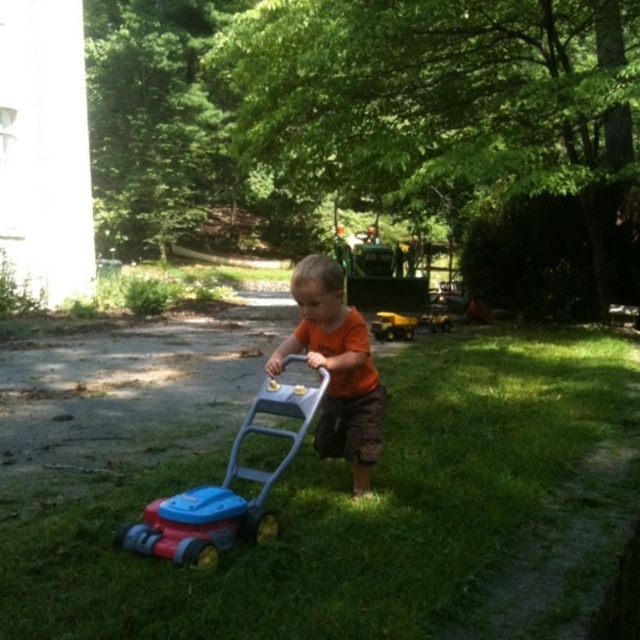
You are a photographer trying to capture a clear shot of the orange matte shirt at center and the blue plastic toy lawn mower at center. Which object should you focus on first if you want to ensure both are in focus, considering their sizes?

The orange matte shirt at center is larger in size than the blue plastic toy lawn mower at center. To ensure both are in focus, focus on the orange matte shirt at center first since it is larger and will require more precise focusing.

Based on the scene description, if the orange matte shirt at center is part of the child, where would the green grass at center be in relation to the child?

The green grass at center is below the orange matte shirt at center, so the grass is located beneath the child since the shirt is part of the child.

You are a drone operator trying to capture a photo of the child pushing the toy lawnmower. The drone is currently hovering at point (346, 508). What is directly below the drone?

The point (346, 508) is directly above the green grass at center, so the drone is hovering above the green grass at center.